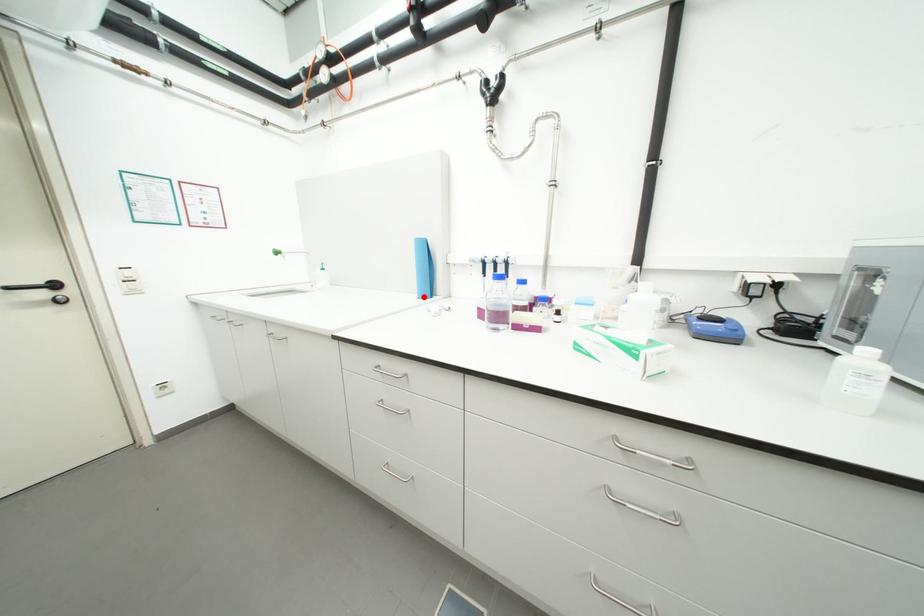
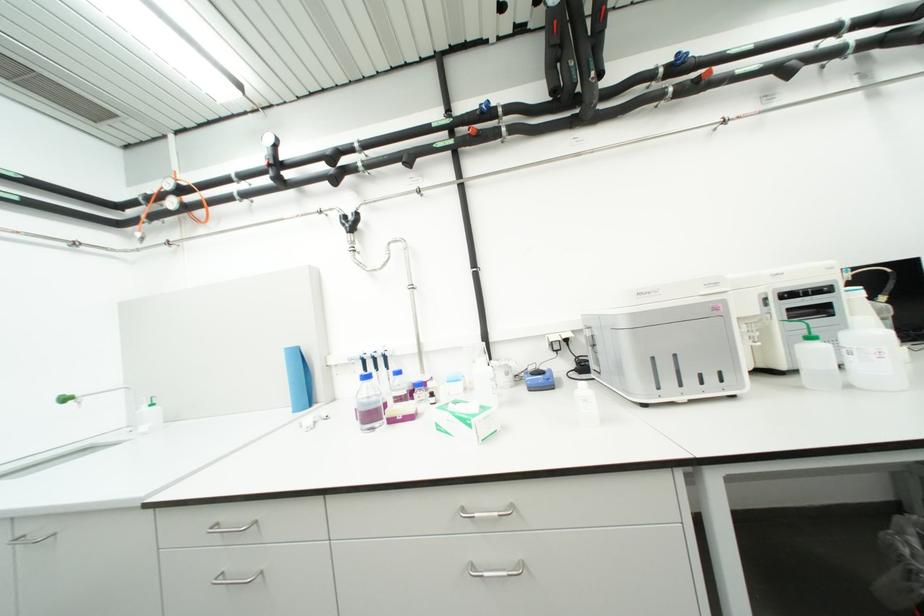
In the second image, find the point that corresponds to the highlighted location in the first image.

(298, 411)